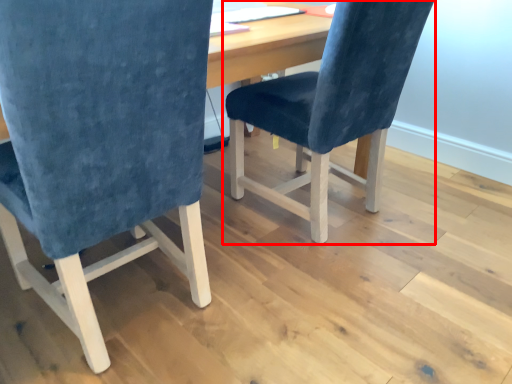
Question: Where is chair (annotated by the red box) located in relation to chair in the image?

Choices:
 (A) right
 (B) left

Answer: (A)